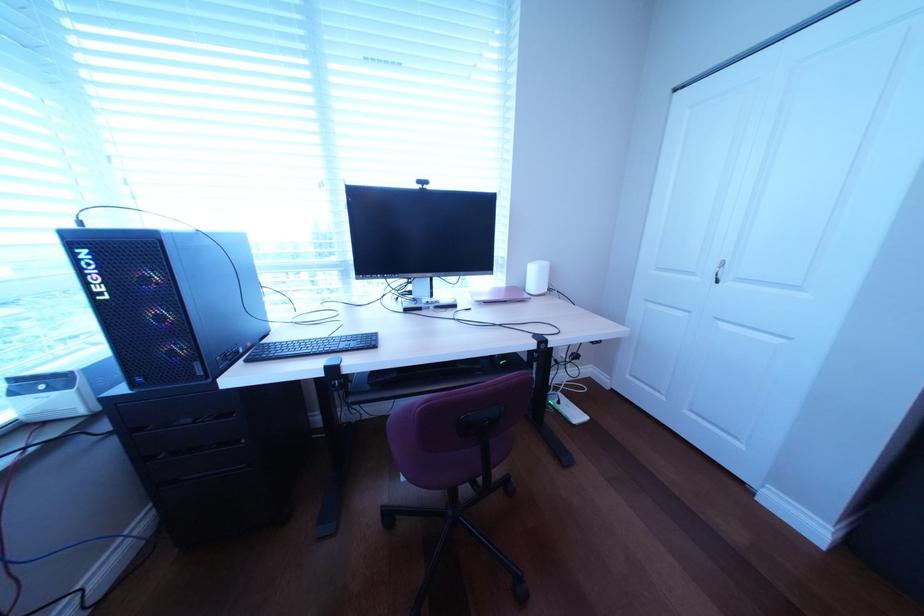
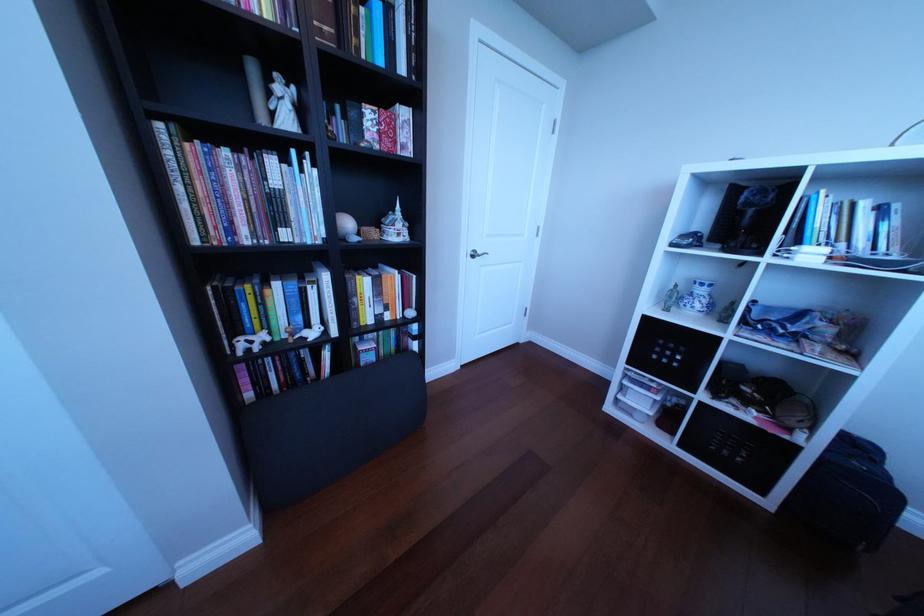
The first image is from the beginning of the video and the second image is from the end. How did the camera likely rotate when shooting the video?

The camera's rotation is toward right-down.